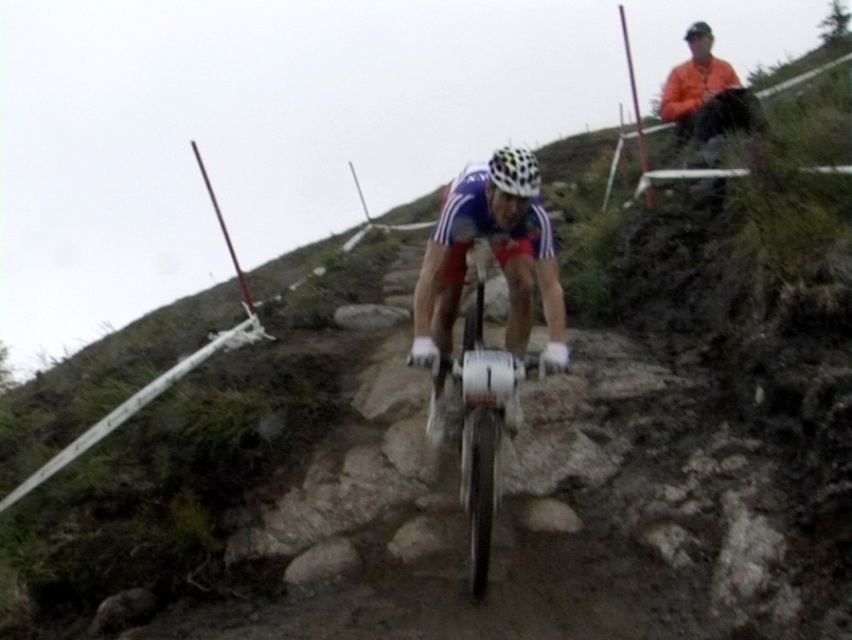
Who is more distant from viewer, (x=461, y=397) or (x=532, y=177)?

Positioned behind is point (x=461, y=397).

Can you confirm if shiny metallic bicycle at center is positioned to the left of multicolored matte bicycle helmet at center?

Indeed, shiny metallic bicycle at center is positioned on the left side of multicolored matte bicycle helmet at center.

Where is `shiny metallic bicycle at center`? shiny metallic bicycle at center is located at coordinates (481, 419).